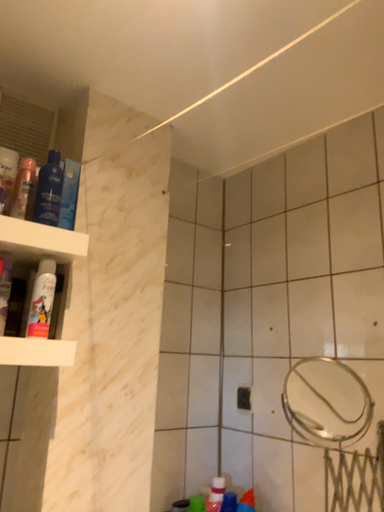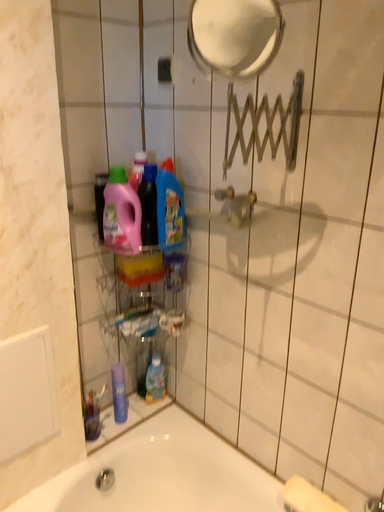
Question: Which way did the camera rotate in the video?

Choices:
 (A) rotated downward
 (B) rotated upward

Answer: (A)